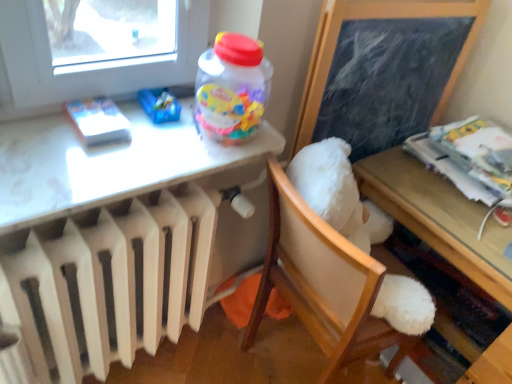
The height and width of the screenshot is (384, 512). In order to click on vacant area on top of white glossy table at upper left, which appears as the 2th table when viewed from the right (from a real-world perspective) in this screenshot , I will do [x=119, y=141].